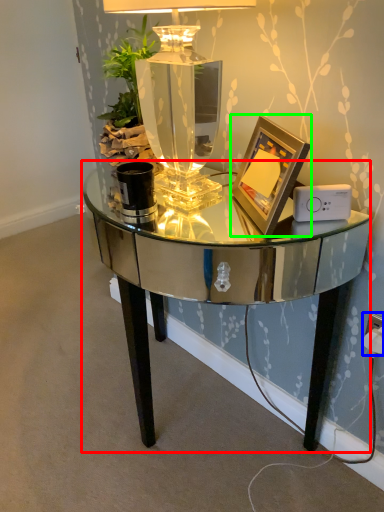
Question: Estimate the real-world distances between objects in this image. Which object is closer to table (highlighted by a red box), electric outlet (highlighted by a blue box) or picture frame (highlighted by a green box)?

Choices:
 (A) electric outlet
 (B) picture frame

Answer: (B)